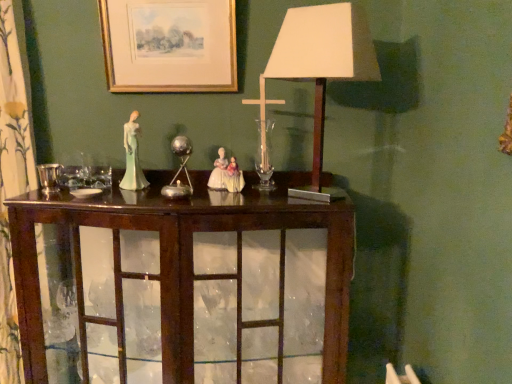
The height and width of the screenshot is (384, 512). I want to click on vacant area situated to the left side of metallic silver candle holder at center, arranged as the 2th candle holder when viewed from the left, so click(x=114, y=193).